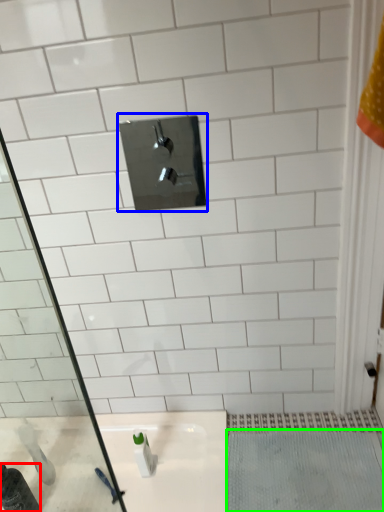
Question: Based on their relative distances, which object is nearer to bottle (highlighted by a red box)? Choose from tap (highlighted by a blue box) and bath mat (highlighted by a green box).

Choices:
 (A) tap
 (B) bath mat

Answer: (B)